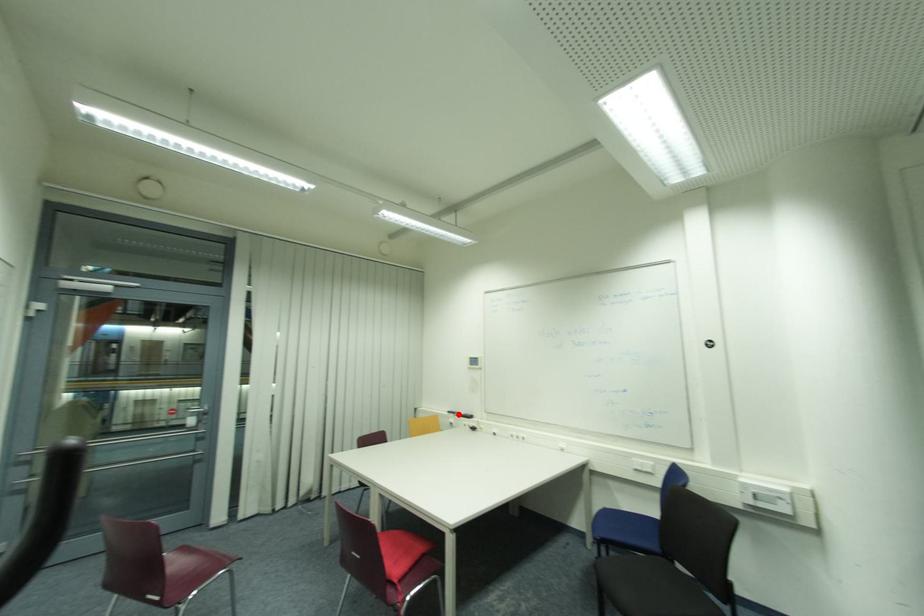
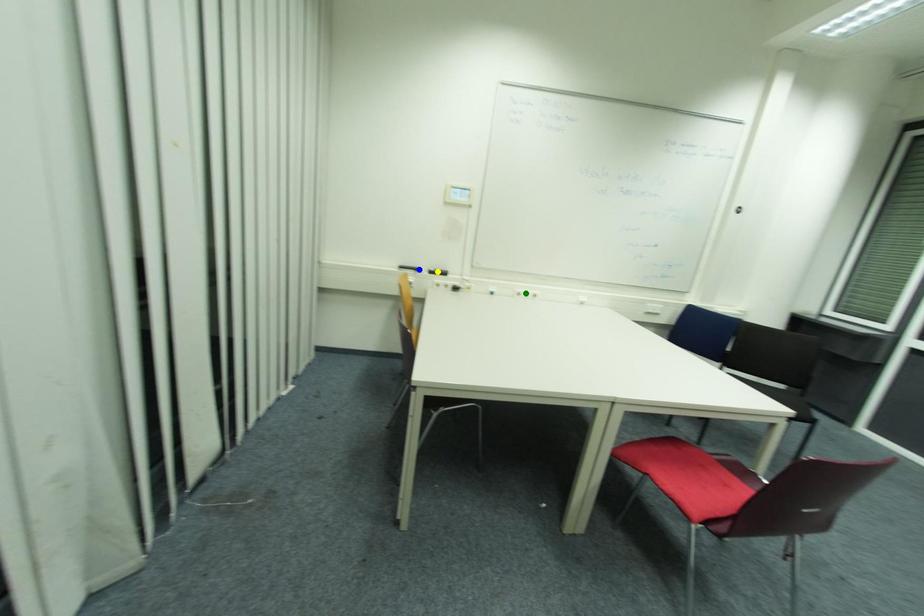
Question: I am providing you with two images of the same scene from different viewpoints. A red point is marked on the first image. You are given multiple points on the second image. Which point in image 2 represents the same 3d spot as the red point in image 1?

Choices:
 (A) yellow point
 (B) blue point
 (C) green point

Answer: (B)